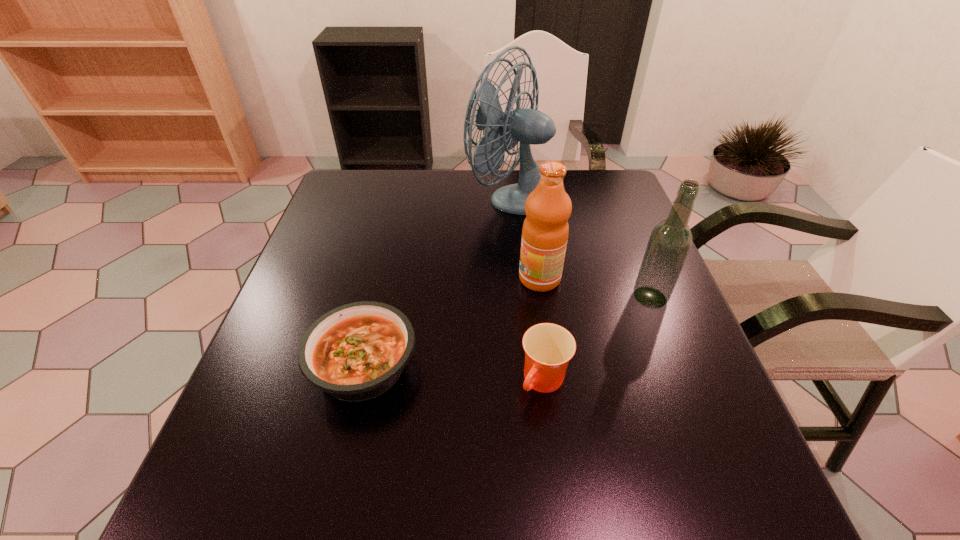
In order to click on the third closest object to the liquor in this screenshot , I will do `click(529, 126)`.

Where is `vacant space that satisfies the following two spatial constraints: 1. on the back side of the liquor; 2. on the label side of the fruit juice`? Image resolution: width=960 pixels, height=540 pixels. vacant space that satisfies the following two spatial constraints: 1. on the back side of the liquor; 2. on the label side of the fruit juice is located at coordinates (643, 279).

Locate an element on the screen. The image size is (960, 540). free space that satisfies the following two spatial constraints: 1. on the label side of the fruit juice; 2. on the right side of the liquor is located at coordinates (542, 297).

Identify the location of free region that satisfies the following two spatial constraints: 1. on the back side of the second shortest object; 2. in front of the farthest object to blow air. (521, 197).

This screenshot has height=540, width=960. In order to click on vacant point that satisfies the following two spatial constraints: 1. in front of the fan to blow air; 2. on the front side of the stew in this screenshot , I will do `click(534, 366)`.

The image size is (960, 540). Identify the location of vacant region that satisfies the following two spatial constraints: 1. on the label side of the fruit juice; 2. on the left side of the rightmost object. click(x=542, y=297).

Locate an element on the screen. vacant position in the image that satisfies the following two spatial constraints: 1. on the back side of the rightmost object; 2. in front of the farthest object to blow air is located at coordinates (611, 197).

Identify the location of blank area in the image that satisfies the following two spatial constraints: 1. in front of the fan to blow air; 2. on the left side of the cup. This screenshot has width=960, height=540. (536, 382).

The image size is (960, 540). What are the coordinates of `free spot that satisfies the following two spatial constraints: 1. on the label side of the liquor; 2. on the right side of the fruit juice` in the screenshot? It's located at (542, 297).